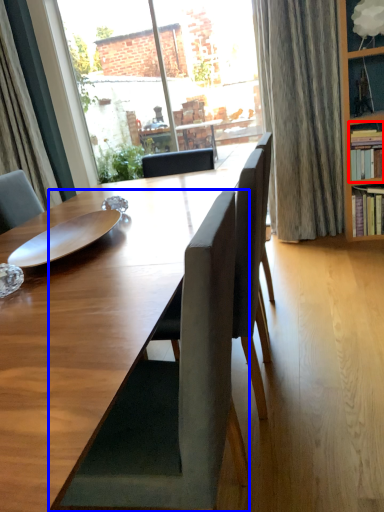
Question: Which point is closer to the camera, shelf (highlighted by a red box) or chair (highlighted by a blue box)?

Choices:
 (A) shelf
 (B) chair

Answer: (B)